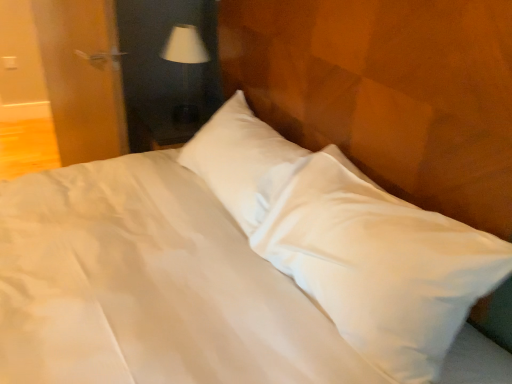
Question: Considering the relative sizes of white plastic electric outlet at upper left and white fabric lampshade at upper center in the image provided, is white plastic electric outlet at upper left thinner than white fabric lampshade at upper center?

Choices:
 (A) yes
 (B) no

Answer: (A)

Question: Is white plastic electric outlet at upper left oriented towards white fabric lampshade at upper center?

Choices:
 (A) yes
 (B) no

Answer: (B)

Question: Is white plastic electric outlet at upper left bigger than white fabric lampshade at upper center?

Choices:
 (A) no
 (B) yes

Answer: (A)

Question: Is white plastic electric outlet at upper left positioned beyond the bounds of white fabric lampshade at upper center?

Choices:
 (A) yes
 (B) no

Answer: (A)

Question: Is white plastic electric outlet at upper left taller than white fabric lampshade at upper center?

Choices:
 (A) no
 (B) yes

Answer: (A)

Question: Considering their positions, is wooden door at left located in front of or behind white fabric lampshade at upper center?

Choices:
 (A) front
 (B) behind

Answer: (A)

Question: Is wooden door at left taller or shorter than white fabric lampshade at upper center?

Choices:
 (A) tall
 (B) short

Answer: (A)

Question: Does point (102, 102) appear closer or farther from the camera than point (182, 117)?

Choices:
 (A) closer
 (B) farther

Answer: (A)

Question: Which is correct: wooden door at left is inside white fabric lampshade at upper center, or outside of it?

Choices:
 (A) outside
 (B) inside

Answer: (A)

Question: Considering the relative positions of white plastic electric outlet at upper left and white fabric lampshade at upper center in the image provided, is white plastic electric outlet at upper left to the left or to the right of white fabric lampshade at upper center?

Choices:
 (A) right
 (B) left

Answer: (B)

Question: Relative to white fabric lampshade at upper center, is white plastic electric outlet at upper left in front or behind?

Choices:
 (A) front
 (B) behind

Answer: (B)

Question: From a real-world perspective, is white plastic electric outlet at upper left physically located above or below white fabric lampshade at upper center?

Choices:
 (A) below
 (B) above

Answer: (A)

Question: In terms of height, does white plastic electric outlet at upper left look taller or shorter compared to white fabric lampshade at upper center?

Choices:
 (A) short
 (B) tall

Answer: (A)

Question: From a real-world perspective, relative to white plastic electric outlet at upper left, is white fabric lampshade at upper center vertically above or below?

Choices:
 (A) above
 (B) below

Answer: (A)

Question: In the image, is white fabric lampshade at upper center positioned in front of or behind white plastic electric outlet at upper left?

Choices:
 (A) behind
 (B) front

Answer: (B)